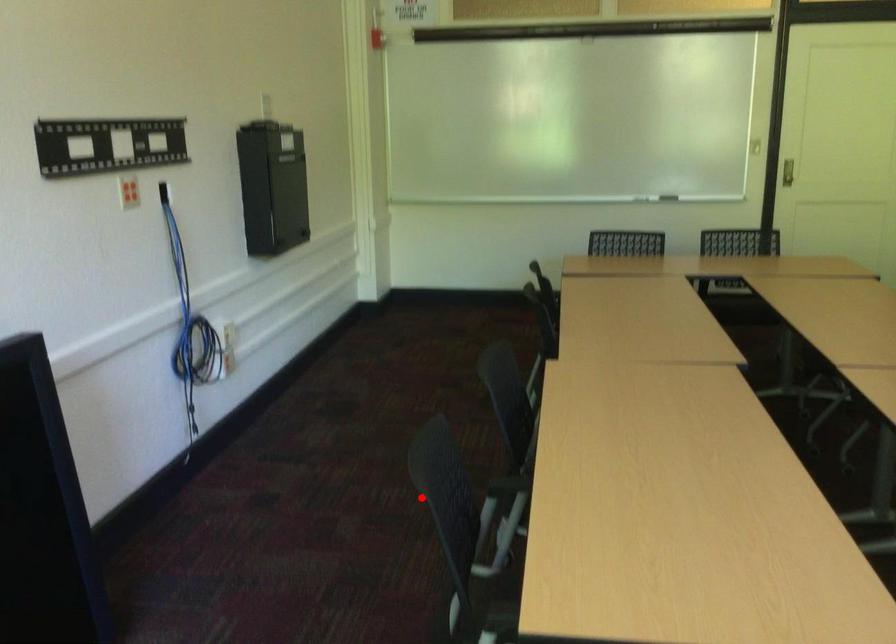
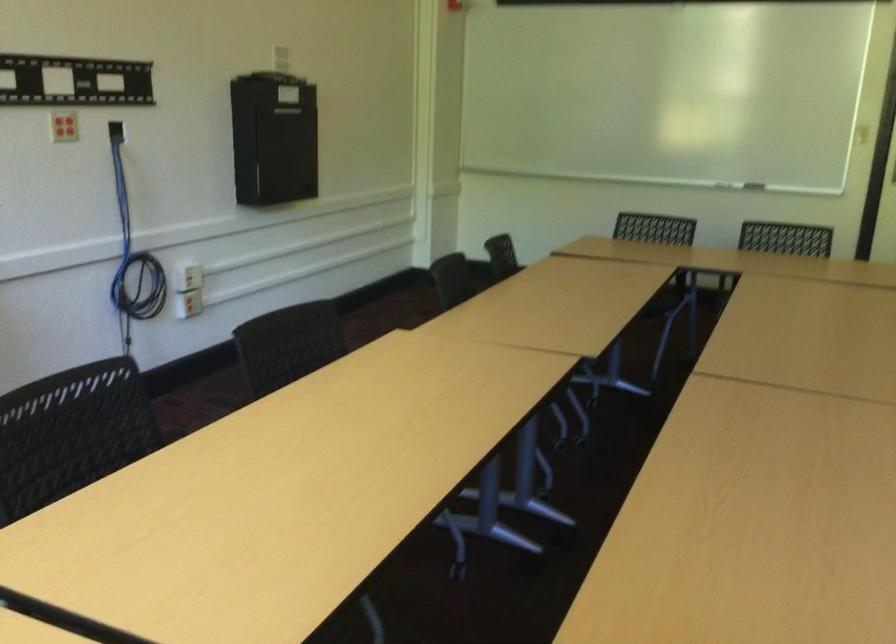
Question: I am providing you with two images of the same scene from different viewpoints. Image1 has a red point marked. In image2, the corresponding 3D location appears at what relative position? Reply with the corresponding letter.

Choices:
 (A) Closer
 (B) Farther

Answer: (B)